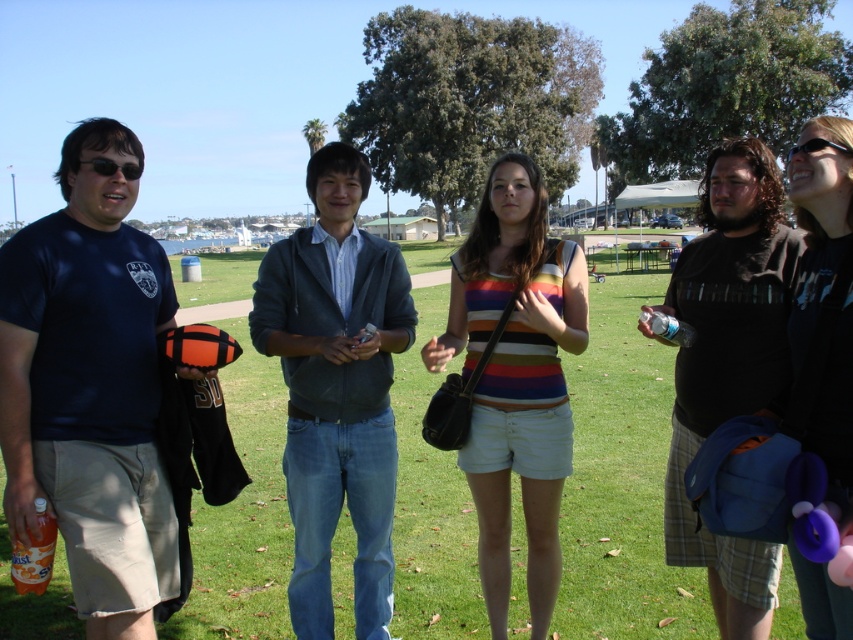
Question: Which object appears closest to the camera in this image?

Choices:
 (A) matte black shirt at upper right
 (B) green grass at center
 (C) black plastic sunglasses at upper right

Answer: (A)

Question: Is green grass at center below dark gray hoodie at center?

Choices:
 (A) no
 (B) yes

Answer: (A)

Question: Which object is the farthest from the striped cotton tank top at center?

Choices:
 (A) dark brown textured shirt at right
 (B) dark gray hoodie at center

Answer: (A)

Question: Estimate the real-world distances between objects in this image. Which object is closer to the black plastic sunglasses at upper right?

Choices:
 (A) dark gray hoodie at center
 (B) matte black shirt at upper right
 (C) green grass at center
 (D) striped cotton tank top at center

Answer: (D)

Question: Does striped cotton tank top at center appear on the left side of black plastic sunglasses at upper right?

Choices:
 (A) no
 (B) yes

Answer: (B)

Question: Can you confirm if matte blue t-shirt at left is positioned below matte black shirt at upper right?

Choices:
 (A) no
 (B) yes

Answer: (B)